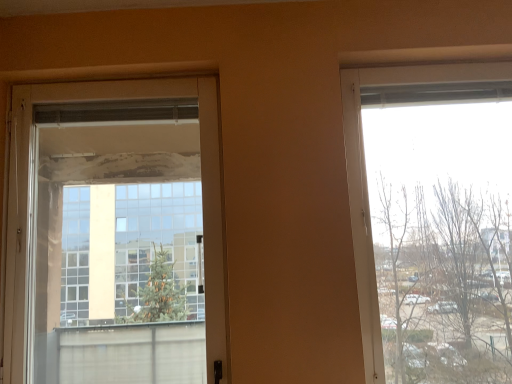
Question: Relative to transparent glass door at left, is transparent glass window at right in front or behind?

Choices:
 (A) front
 (B) behind

Answer: (A)

Question: From a real-world perspective, is transparent glass window at right physically located above or below transparent glass door at left?

Choices:
 (A) above
 (B) below

Answer: (B)

Question: Is point (365, 355) positioned closer to the camera than point (153, 92)?

Choices:
 (A) farther
 (B) closer

Answer: (B)

Question: From a real-world perspective, is transparent glass door at left above or below transparent glass window at right?

Choices:
 (A) below
 (B) above

Answer: (B)

Question: Is transparent glass door at left taller or shorter than transparent glass window at right?

Choices:
 (A) tall
 (B) short

Answer: (B)

Question: From the image's perspective, is transparent glass door at left positioned above or below transparent glass window at right?

Choices:
 (A) above
 (B) below

Answer: (B)

Question: Is transparent glass door at left situated inside transparent glass window at right or outside?

Choices:
 (A) inside
 (B) outside

Answer: (B)